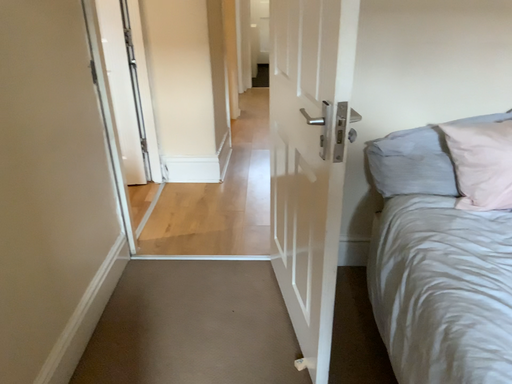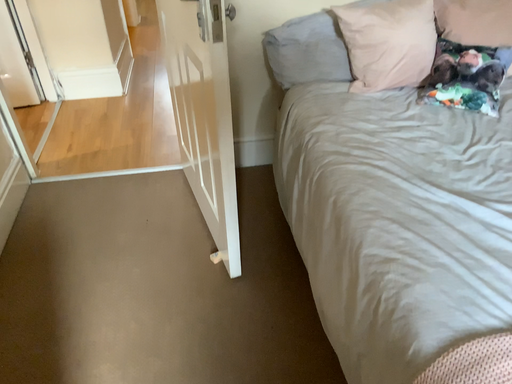
Question: How did the camera likely rotate when shooting the video?

Choices:
 (A) rotated right
 (B) rotated left

Answer: (A)